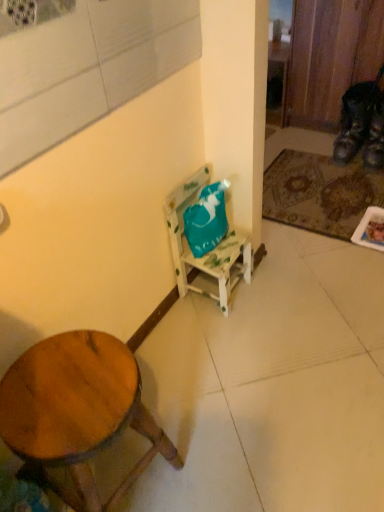
Question: Considering the relative positions of wooden stool at lower left and brown textured mat at lower right in the image provided, is wooden stool at lower left to the left or to the right of brown textured mat at lower right?

Choices:
 (A) right
 (B) left

Answer: (B)

Question: In terms of height, does wooden stool at lower left look taller or shorter compared to brown textured mat at lower right?

Choices:
 (A) short
 (B) tall

Answer: (B)

Question: Estimate the real-world distances between objects in this image. Which object is closer to the brown textured mat at lower right?

Choices:
 (A) leather brown shoe at lower right, marked as the second shoe in a right-to-left arrangement
 (B) teal fabric bag at center
 (C) wooden stool at lower left
 (D) leather at right, which ranks as the second shoe in left-to-right order

Answer: (A)

Question: Estimate the real-world distances between objects in this image. Which object is farther from the teal fabric bag at center?

Choices:
 (A) wooden stool at lower left
 (B) leather at right, placed as the 1th shoe when sorted from right to left
 (C) leather brown shoe at lower right, acting as the 1th shoe starting from the left
 (D) brown textured mat at lower right

Answer: (B)